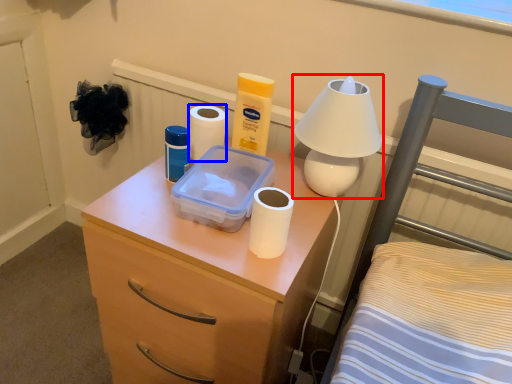
Question: Which point is further to the camera, lamp (highlighted by a red box) or toilet paper (highlighted by a blue box)?

Choices:
 (A) lamp
 (B) toilet paper

Answer: (B)